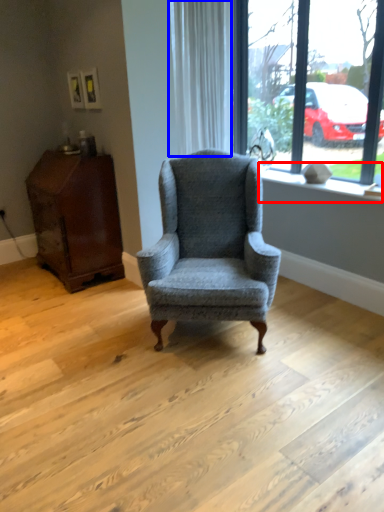
Question: Among these objects, which one is nearest to the camera, window sill (highlighted by a red box) or curtain (highlighted by a blue box)?

Choices:
 (A) window sill
 (B) curtain

Answer: (A)